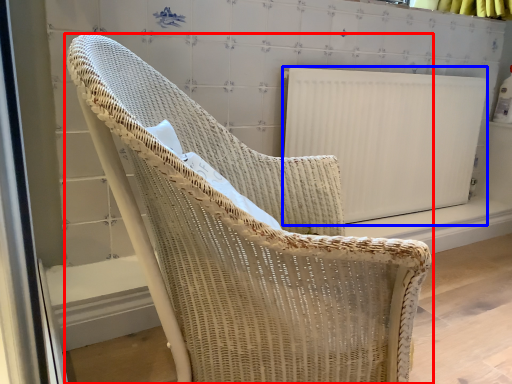
Question: Which point is closer to the camera, chair (highlighted by a red box) or radiator (highlighted by a blue box)?

Choices:
 (A) chair
 (B) radiator

Answer: (A)